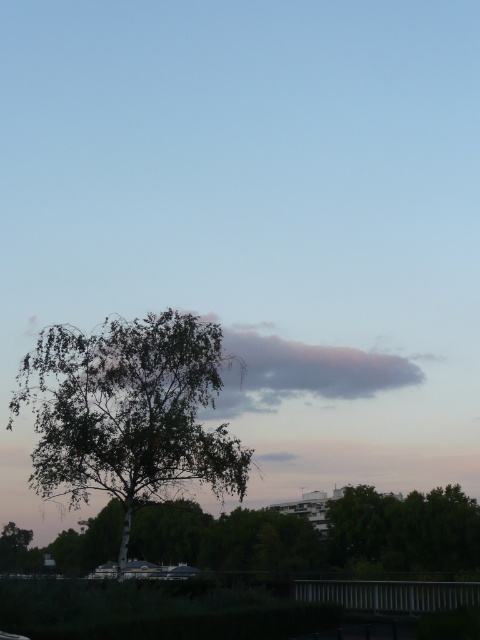
Does green leafy tree at center come in front of green leafy tree at lower center?

Yes, it is.

Which is above, green leafy tree at center or green leafy tree at lower center?

Positioned higher is green leafy tree at center.

Which is behind, point (37, 387) or point (108, 513)?

Point (108, 513)

The width and height of the screenshot is (480, 640). I want to click on green leafy tree at center, so click(x=129, y=412).